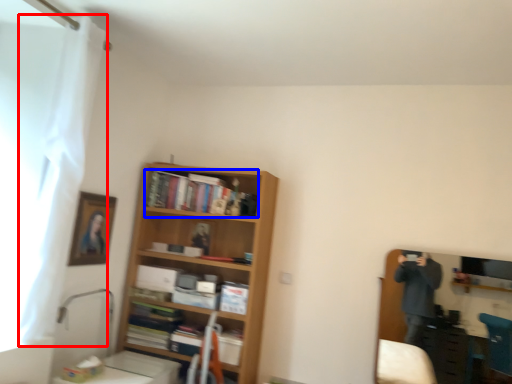
Question: Which object appears farthest to the camera in this image, curtain (highlighted by a red box) or book (highlighted by a blue box)?

Choices:
 (A) curtain
 (B) book

Answer: (B)